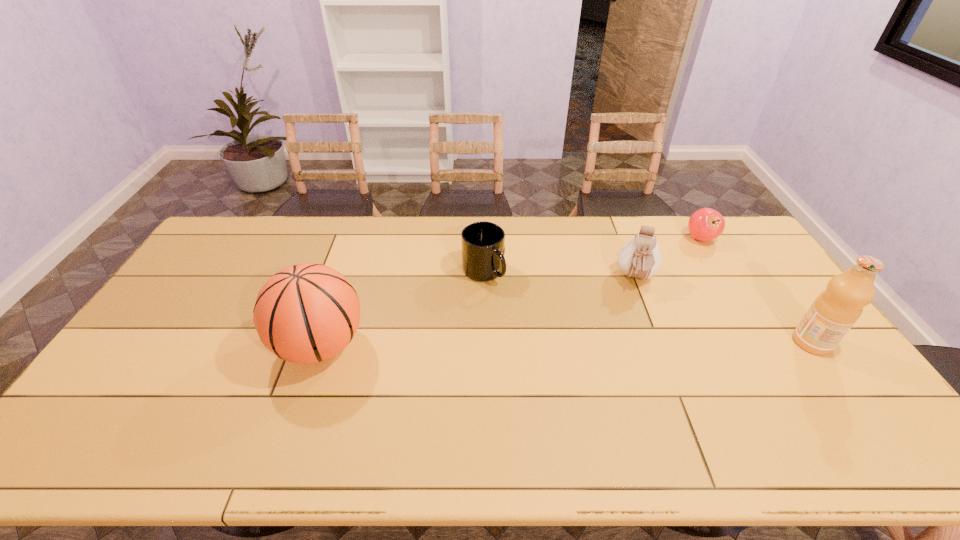
Locate an element on the screen. The image size is (960, 540). free location that satisfies the following two spatial constraints: 1. on the front side of the pouch; 2. on the front label of the fruit juice is located at coordinates (660, 342).

You are a GUI agent. You are given a task and a screenshot of the screen. Output one action in this format:
    pyautogui.click(x=<x>, y=<y>)
    Task: Click on the vacant area that satisfies the following two spatial constraints: 1. on the back side of the leftmost object; 2. on the front label of the rightmost object
    This screenshot has width=960, height=540.
    Given the screenshot: What is the action you would take?
    pyautogui.click(x=322, y=342)

Identify the location of free location that satisfies the following two spatial constraints: 1. on the back side of the farthest object; 2. on the left side of the third shortest object. click(620, 238).